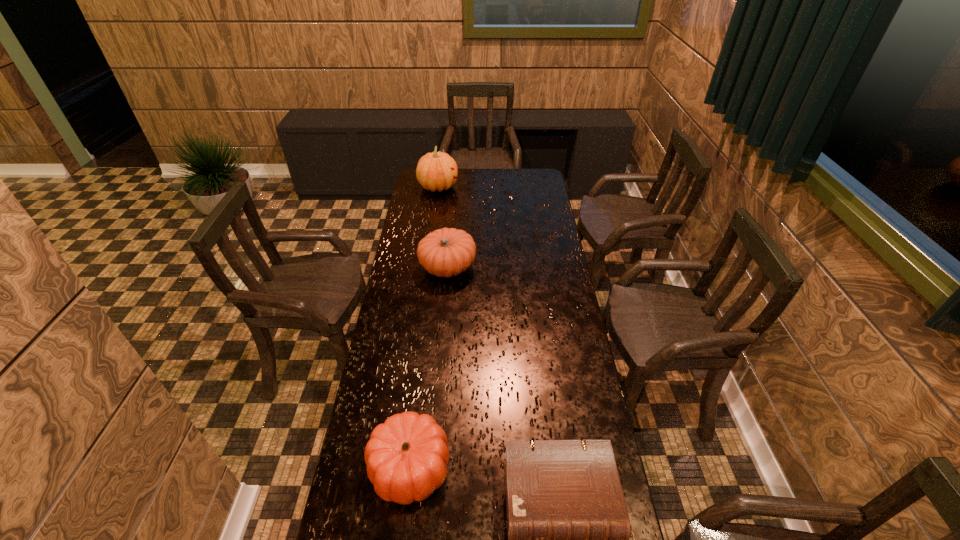
Find the location of a particular element. This screenshot has width=960, height=540. free location that satisfies the following two spatial constraints: 1. on the carved face of the farthest object; 2. on the right side of the second farthest pumpkin is located at coordinates (427, 267).

Identify the location of vacant region that satisfies the following two spatial constraints: 1. on the carved face of the nearest pumpkin; 2. on the left side of the farthest object. This screenshot has height=540, width=960. (400, 467).

This screenshot has height=540, width=960. In order to click on vacant space that satisfies the following two spatial constraints: 1. on the carved face of the tallest object; 2. on the back side of the nearest pumpkin in this screenshot , I will do `click(400, 467)`.

At what (x,y) coordinates should I click in order to perform the action: click on free spot that satisfies the following two spatial constraints: 1. on the carved face of the farthest object; 2. on the left side of the nearest pumpkin. Please return your answer as a coordinate pair (x, y). Looking at the image, I should click on (400, 467).